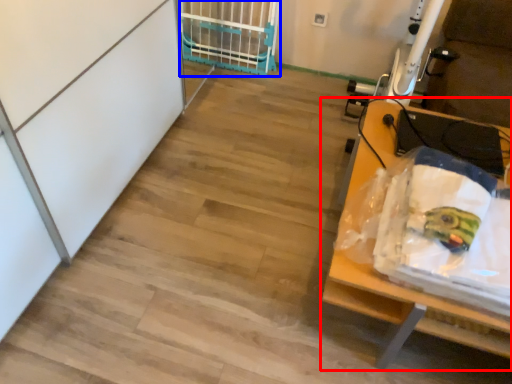
Question: Which object is closer to the camera taking this photo, furniture (highlighted by a red box) or cage (highlighted by a blue box)?

Choices:
 (A) furniture
 (B) cage

Answer: (A)